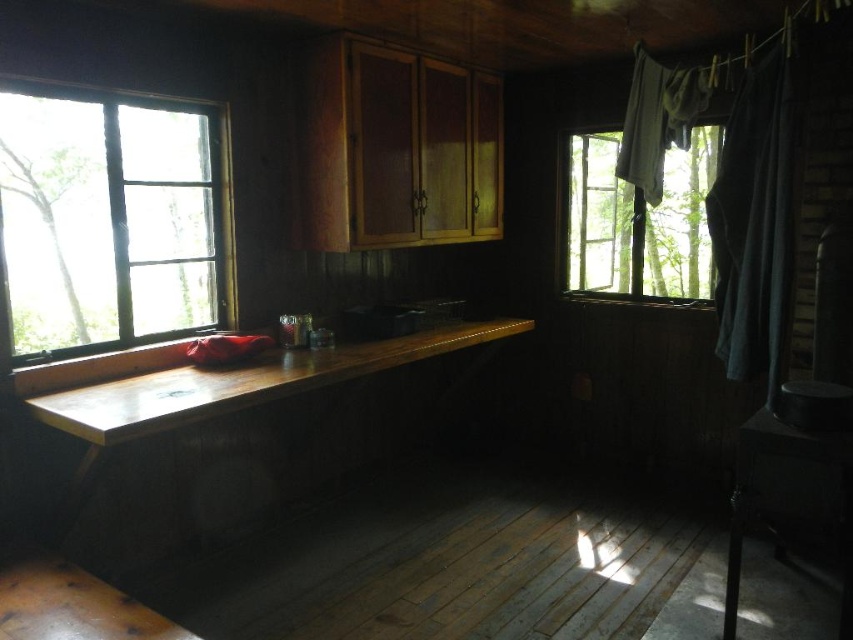
You are inside the rustic wooden cabin and want to let in more natural light. Which object should you adjust, the clear glass window at left or the gray fabric curtain at right?

The clear glass window at left is located above the gray fabric curtain at right, so adjusting the gray fabric curtain at right would allow more natural light into the cabin.

You are inside the rustic wooden cabin and want to close the gray fabric curtain at right to block the light coming through the transparent glass window at upper right. Can you do this without moving the window?

The gray fabric curtain at right is closer to the viewer than the transparent glass window at upper right, so yes, you can close the gray fabric curtain at right to block the light coming through the transparent glass window at upper right without moving the window.